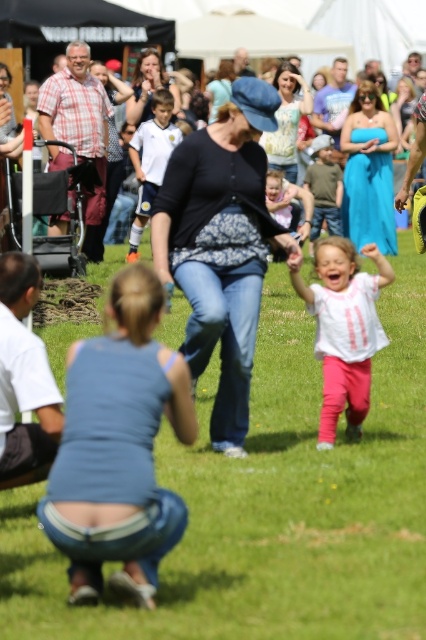
You are standing in the middle of the grassy field and see the green grass at center and the blue denim jeans at center. Which object is wider?

The green grass at center is wider than the blue denim jeans at center.

You are a photographer trying to capture a candid shot of the light pink fabric dress at center and the matte black hat at center. Since you want to focus on the dress, which object should you prioritize positioning your camera closer to?

The light pink fabric dress at center is closer to the viewer than the matte black hat at center, so you should position your camera closer to the light pink fabric dress at center to ensure it remains the main focus.